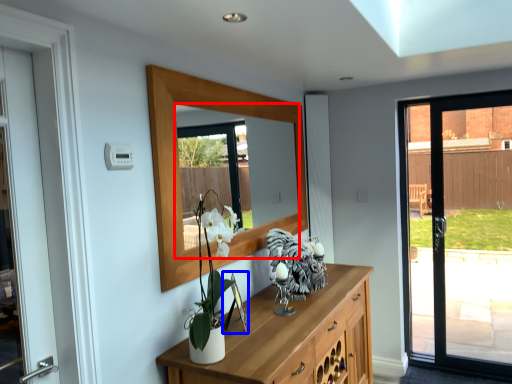
Question: Which of the following is the farthest to the observer, mirror (highlighted by a red box) or picture frame (highlighted by a blue box)?

Choices:
 (A) mirror
 (B) picture frame

Answer: (B)